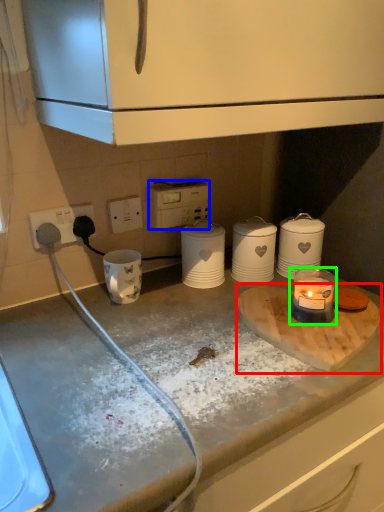
Question: Based on their relative distances, which object is farther from cutting board (highlighted by a red box)? Choose from appliance (highlighted by a blue box) and candle holder (highlighted by a green box).

Choices:
 (A) appliance
 (B) candle holder

Answer: (A)